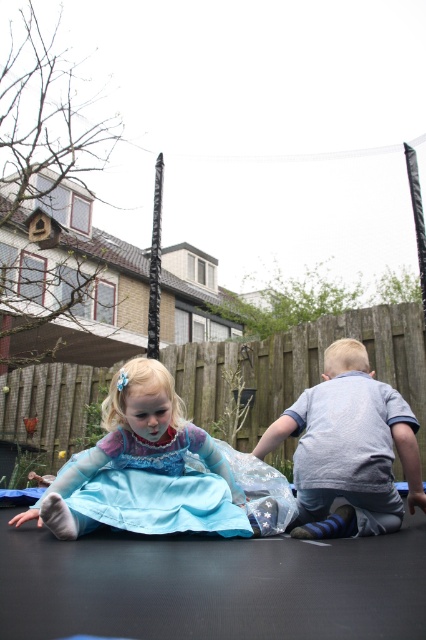
Is blue satin dress at center closer to camera compared to light blue cotton shirt at center?

Yes, blue satin dress at center is in front of light blue cotton shirt at center.

Does blue satin dress at center appear under light blue cotton shirt at center?

Yes, blue satin dress at center is below light blue cotton shirt at center.

Is point (91, 486) less distant than point (362, 493)?

No.

Identify the location of blue satin dress at center. The width and height of the screenshot is (426, 640). (141, 464).